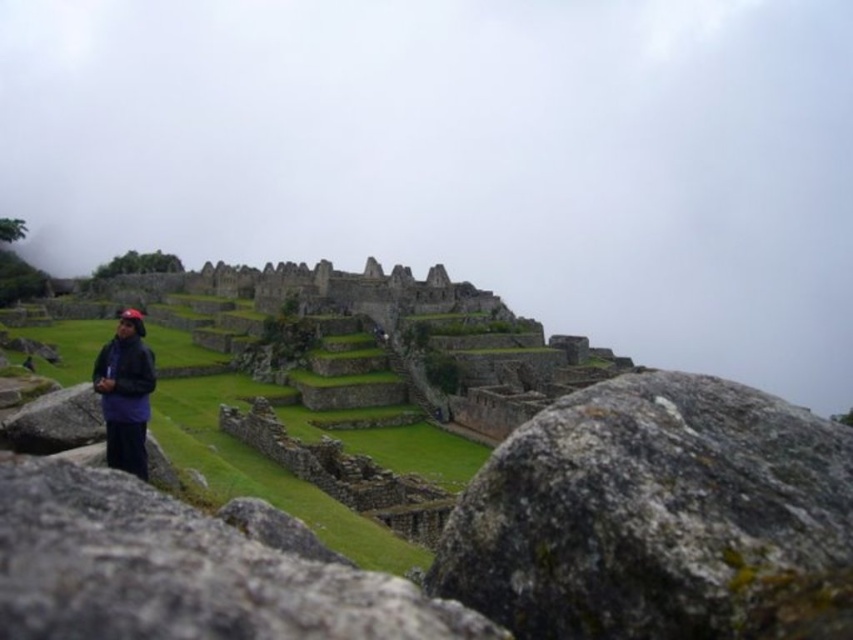
Question: Among these objects, which one is nearest to the camera?

Choices:
 (A) white fog at upper center
 (B) gray rough stone at center

Answer: (B)

Question: Is white fog at upper center positioned in front of gray rough stone at center?

Choices:
 (A) no
 (B) yes

Answer: (A)

Question: Considering the relative positions of white fog at upper center and gray rough stone at center in the image provided, where is white fog at upper center located with respect to gray rough stone at center?

Choices:
 (A) above
 (B) below

Answer: (A)

Question: Does white fog at upper center appear under gray rough stone at center?

Choices:
 (A) yes
 (B) no

Answer: (B)

Question: Which point is closer to the camera taking this photo?

Choices:
 (A) (482, 109)
 (B) (717, 612)

Answer: (B)

Question: Which object appears closest to the camera in this image?

Choices:
 (A) white fog at upper center
 (B) gray rough stone at center

Answer: (B)